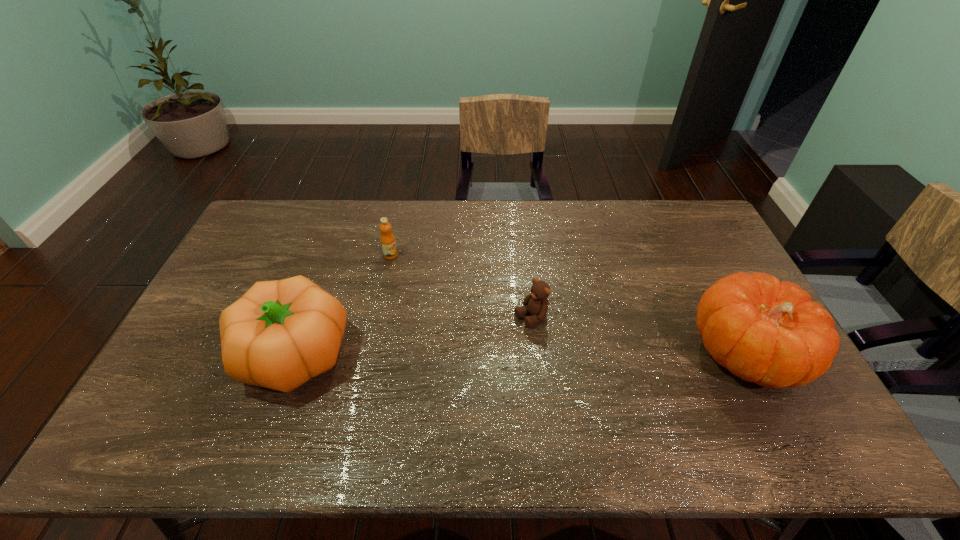
Image resolution: width=960 pixels, height=540 pixels. Identify the location of the leftmost object. (280, 334).

You are a GUI agent. You are given a task and a screenshot of the screen. Output one action in this format:
    pyautogui.click(x=<x>, y=<y>)
    Task: Click on the rightmost object
    Image resolution: width=960 pixels, height=540 pixels.
    Given the screenshot: What is the action you would take?
    pyautogui.click(x=763, y=331)

Find the location of `the third object from right to left`. the third object from right to left is located at coordinates (388, 242).

At what (x,y) coordinates should I click in order to perform the action: click on the farthest object. Please return your answer as a coordinate pair (x, y). Looking at the image, I should click on (388, 242).

The image size is (960, 540). In order to click on the third object from left to right in this screenshot , I will do `click(536, 303)`.

This screenshot has height=540, width=960. In order to click on the shortest object in this screenshot , I will do `click(536, 303)`.

Find the location of a particular element. The height and width of the screenshot is (540, 960). vacant region located 0.070m on the carved face of the left pumpkin is located at coordinates tap(211, 354).

The width and height of the screenshot is (960, 540). I want to click on vacant space located 0.150m on the carved face of the left pumpkin, so click(x=181, y=354).

Locate an element on the screen. free location located 0.120m on the carved face of the left pumpkin is located at coordinates pos(193,354).

Where is `vacant space located 0.400m on the back of the right pumpkin`? vacant space located 0.400m on the back of the right pumpkin is located at coordinates (681, 227).